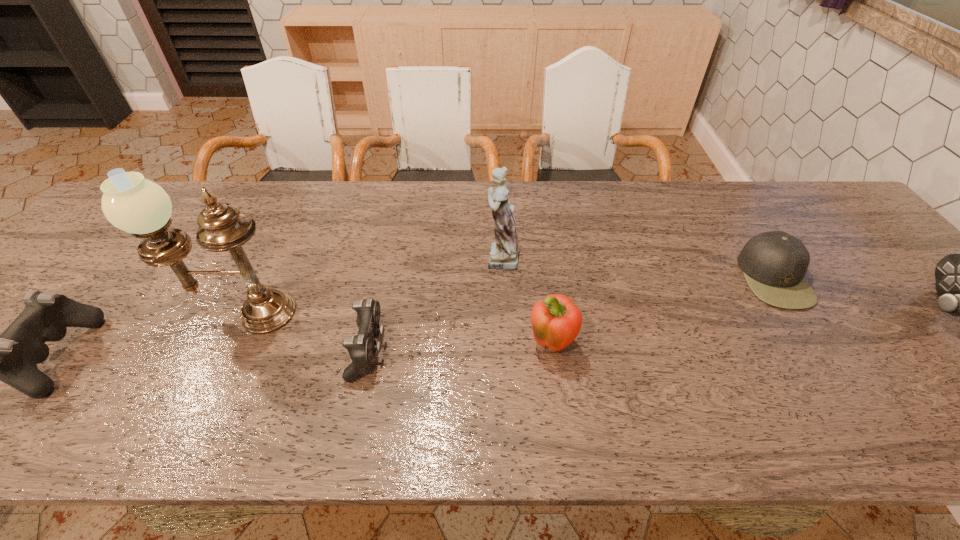
Locate an element on the screen. The width and height of the screenshot is (960, 540). empty space between the leftmost object and the pepper is located at coordinates (305, 351).

Identify the location of unoccupied position between the second object from right to left and the oil lamp. The height and width of the screenshot is (540, 960). (507, 295).

The height and width of the screenshot is (540, 960). I want to click on vacant space that's between the figurine and the pepper, so click(x=525, y=301).

Where is `free space that is in between the fourth tallest object and the second tallest control`? The image size is (960, 540). free space that is in between the fourth tallest object and the second tallest control is located at coordinates (305, 351).

At what (x,y) coordinates should I click in order to perform the action: click on unoccupied position between the second tallest object and the fourth tallest object. Please return your answer as a coordinate pair (x, y). This screenshot has width=960, height=540. Looking at the image, I should click on (525, 301).

Locate an element on the screen. object that stands as the fourth closest to the fourth tallest object is located at coordinates (136, 205).

The height and width of the screenshot is (540, 960). Find the location of `object that stands as the fourth closest to the figurine`. object that stands as the fourth closest to the figurine is located at coordinates (774, 263).

The width and height of the screenshot is (960, 540). Identify the location of control that stands as the second closest to the shortest control. (959, 277).

Identify which control is the second nearest to the second object from right to left. Please provide its 2D coordinates. Your answer should be formatted as a tuple, i.e. [(x, y)], where the tuple contains the x and y coordinates of a point satisfying the conditions above.

[(361, 348)]

I want to click on vacant space that satisfies the following two spatial constraints: 1. on the back side of the fourth tallest object; 2. on the front-facing side of the figurine, so click(x=539, y=257).